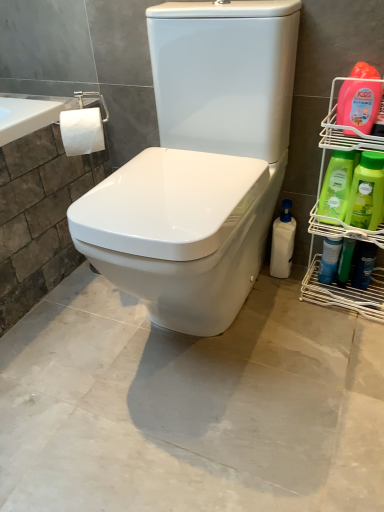
Question: Considering the relative sizes of green plastic bottles at right, placed as the second cleaning product when sorted from left to right, and blue glossy spray bottle at right, arranged as the 5th cleaning product when viewed from the left, in the image provided, is green plastic bottles at right, placed as the second cleaning product when sorted from left to right, shorter than blue glossy spray bottle at right, arranged as the 5th cleaning product when viewed from the left,?

Choices:
 (A) yes
 (B) no

Answer: (B)

Question: Is green plastic bottles at right, which ranks as the 5th cleaning product in right-to-left order, outside of blue glossy spray bottle at right, arranged as the second cleaning product when viewed from the right?

Choices:
 (A) yes
 (B) no

Answer: (A)

Question: Is green plastic bottles at right, placed as the second cleaning product when sorted from left to right, looking in the opposite direction of blue glossy spray bottle at right, arranged as the 5th cleaning product when viewed from the left?

Choices:
 (A) yes
 (B) no

Answer: (B)

Question: Is blue glossy spray bottle at right, arranged as the 5th cleaning product when viewed from the left, completely or partially inside green plastic bottles at right, which ranks as the 5th cleaning product in right-to-left order?

Choices:
 (A) no
 (B) yes

Answer: (A)

Question: Is green plastic bottles at right, which ranks as the 5th cleaning product in right-to-left order, in front of blue glossy spray bottle at right, arranged as the second cleaning product when viewed from the right?

Choices:
 (A) no
 (B) yes

Answer: (B)

Question: Does green plastic bottles at right, which ranks as the 5th cleaning product in right-to-left order, have a greater width compared to blue glossy spray bottle at right, arranged as the second cleaning product when viewed from the right?

Choices:
 (A) no
 (B) yes

Answer: (B)

Question: Considering the relative sizes of white plastic bottle at lower right, the first cleaning product in the left-to-right sequence, and green plastic bottles at right in the image provided, is white plastic bottle at lower right, the first cleaning product in the left-to-right sequence, shorter than green plastic bottles at right?

Choices:
 (A) no
 (B) yes

Answer: (B)

Question: Considering the relative positions of white plastic bottle at lower right, which ranks as the 6th cleaning product in right-to-left order, and green plastic bottles at right in the image provided, is white plastic bottle at lower right, which ranks as the 6th cleaning product in right-to-left order, to the right of green plastic bottles at right from the viewer's perspective?

Choices:
 (A) yes
 (B) no

Answer: (B)

Question: Is white plastic bottle at lower right, which ranks as the 6th cleaning product in right-to-left order, far away from green plastic bottles at right?

Choices:
 (A) yes
 (B) no

Answer: (B)

Question: Is green plastic bottles at right completely or partially inside white plastic bottle at lower right, which ranks as the 6th cleaning product in right-to-left order?

Choices:
 (A) no
 (B) yes

Answer: (A)

Question: Is white plastic bottle at lower right, the first cleaning product in the left-to-right sequence, facing towards green plastic bottles at right?

Choices:
 (A) yes
 (B) no

Answer: (B)

Question: Does white plastic bottle at lower right, which ranks as the 6th cleaning product in right-to-left order, have a larger size compared to green plastic bottles at right?

Choices:
 (A) no
 (B) yes

Answer: (A)

Question: Does green plastic bottles at right, which ranks as the 5th cleaning product in right-to-left order, have a greater width compared to green plastic bottles at right?

Choices:
 (A) no
 (B) yes

Answer: (A)